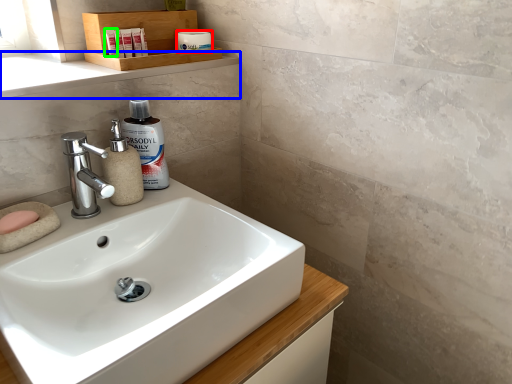
Question: Considering the real-world distances, which object is closest to toiletry (highlighted by a red box)? window sill (highlighted by a blue box) or toiletry (highlighted by a green box).

Choices:
 (A) window sill
 (B) toiletry

Answer: (B)